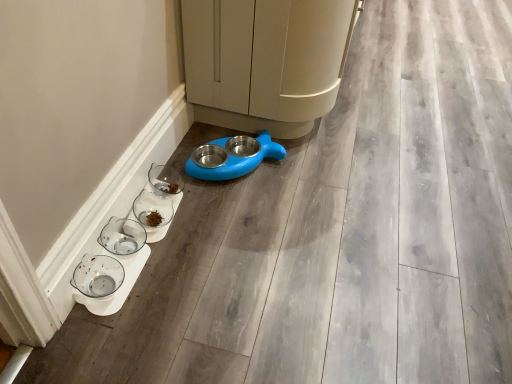
Question: Is transparent glass bowl at lower left, which is counted as the first glass bowl, starting from the front, bigger or smaller than blue plastic bowl at lower center?

Choices:
 (A) big
 (B) small

Answer: (B)

Question: In terms of height, does transparent glass bowl at lower left, the third glass bowl when ordered from back to front, look taller or shorter compared to blue plastic bowl at lower center?

Choices:
 (A) tall
 (B) short

Answer: (B)

Question: Which is farther from the transparent glass bowl at lower left, the third glass bowl when ordered from back to front?

Choices:
 (A) blue plastic bowl at lower center
 (B) clear glass bowl at lower left, the 2th glass bowl viewed from the back
 (C) blue plastic pet feeder at center
 (D) clear glass bowl at lower center, which is the first glass bowl in back-to-front order

Answer: (A)

Question: Estimate the real-world distances between objects in this image. Which object is farther from the clear glass bowl at lower left, the 2th glass bowl in the front-to-back sequence?

Choices:
 (A) clear glass bowl at lower center, the 3th glass bowl in the front-to-back sequence
 (B) blue plastic bowl at lower center
 (C) transparent glass bowl at lower left, the third glass bowl when ordered from back to front
 (D) blue plastic pet feeder at center

Answer: (B)